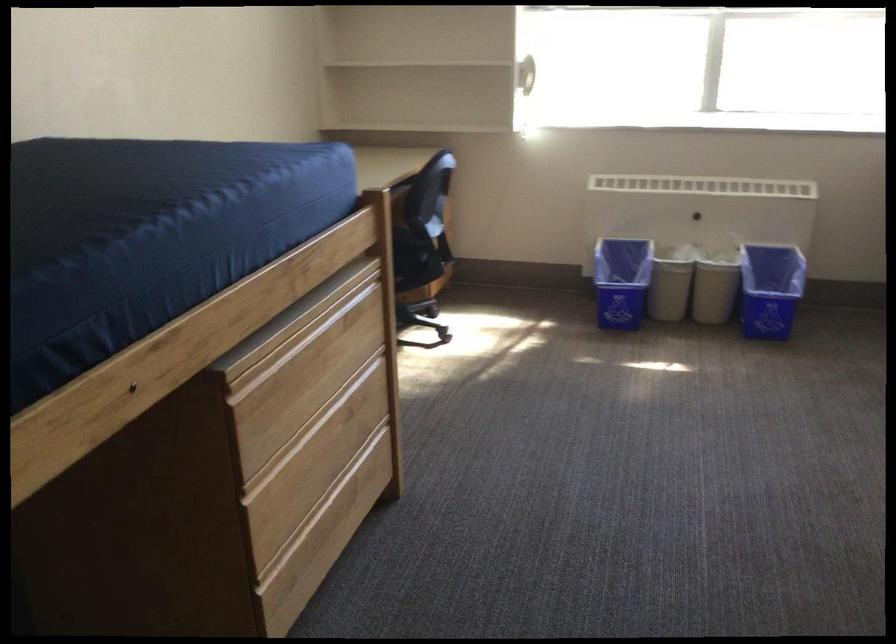
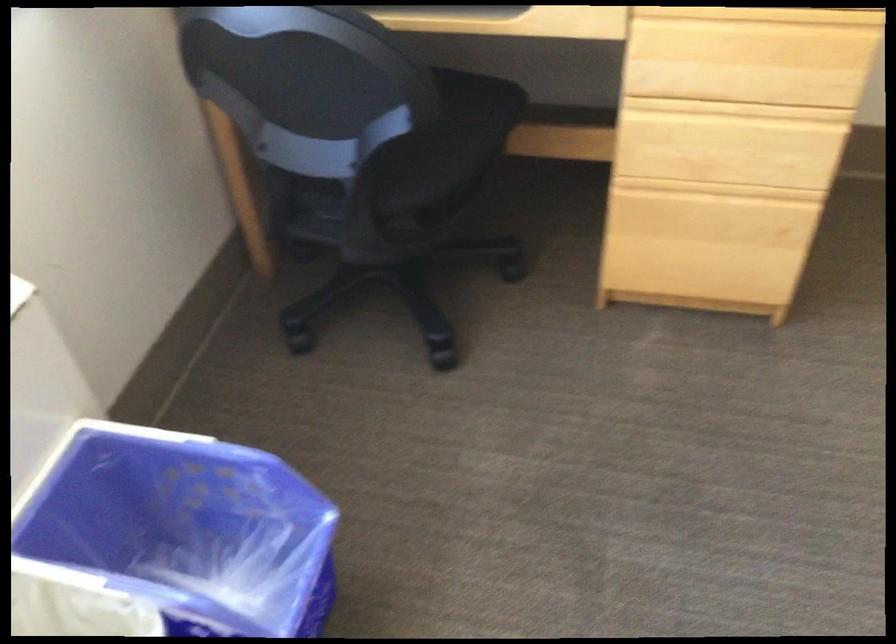
The point at (770, 288) is marked in the first image. Where is the corresponding point in the second image?

(183, 531)